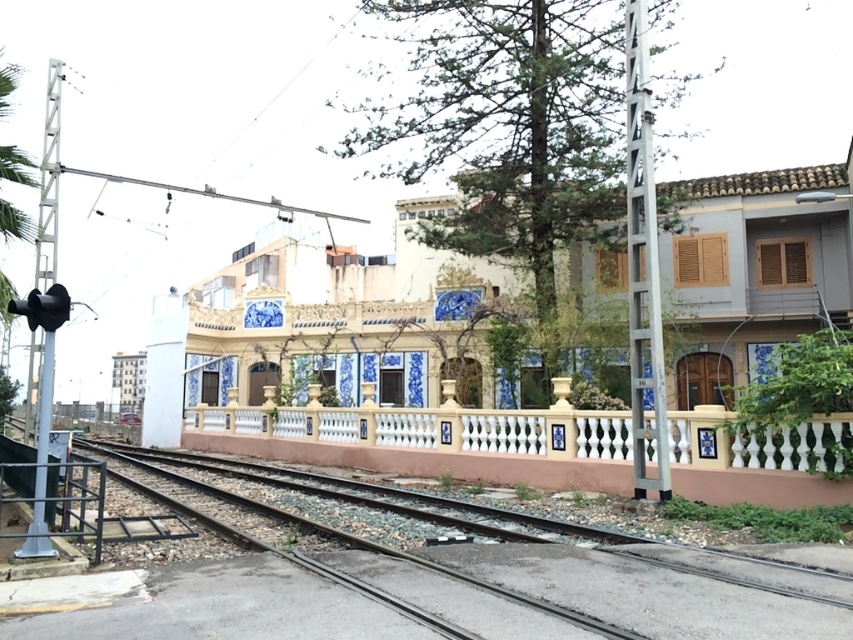
Question: Is smooth concrete tracks at center further to camera compared to smooth concrete rail at center?

Choices:
 (A) no
 (B) yes

Answer: (A)

Question: Does smooth concrete tracks at center appear on the right side of smooth concrete rail at center?

Choices:
 (A) yes
 (B) no

Answer: (B)

Question: Which point is closer to the camera taking this photo?

Choices:
 (A) (502, 483)
 (B) (289, 516)

Answer: (B)

Question: Is smooth concrete tracks at center to the right of smooth concrete rail at center from the viewer's perspective?

Choices:
 (A) yes
 (B) no

Answer: (B)

Question: Which object appears farthest from the camera in this image?

Choices:
 (A) smooth concrete rail at center
 (B) smooth concrete tracks at center

Answer: (A)